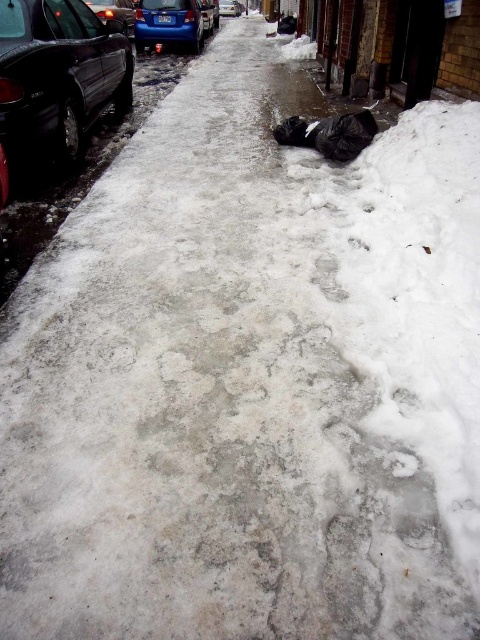
Question: Which object is closer to the camera taking this photo?

Choices:
 (A) shiny blue sedan at upper left
 (B) blue metallic car at center

Answer: (A)

Question: Does shiny metallic car at upper left appear on the right side of blue metallic car at center?

Choices:
 (A) no
 (B) yes

Answer: (A)

Question: Where is shiny blue sedan at upper left located in relation to blue metallic car at center in the image?

Choices:
 (A) right
 (B) left

Answer: (B)

Question: Which is farther from the shiny metallic car at upper left?

Choices:
 (A) blue metallic car at center
 (B) shiny black sedan at left

Answer: (A)

Question: Among these objects, which one is farthest from the camera?

Choices:
 (A) shiny black sedan at left
 (B) blue metallic car at center
 (C) shiny metallic car at upper left

Answer: (B)

Question: Is shiny metallic car at upper left thinner than blue metallic car at center?

Choices:
 (A) yes
 (B) no

Answer: (A)